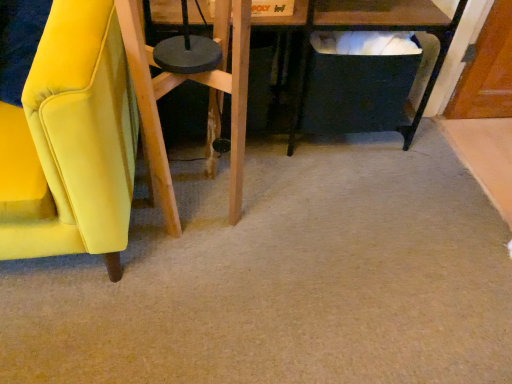
This screenshot has height=384, width=512. What do you see at coordinates (209, 100) in the screenshot?
I see `wooden bar stool at center` at bounding box center [209, 100].

Locate an element on the screen. Image resolution: width=512 pixels, height=384 pixels. wooden bar stool at center is located at coordinates (209, 100).

The image size is (512, 384). Identify the location of wooden bar stool at center. (209, 100).